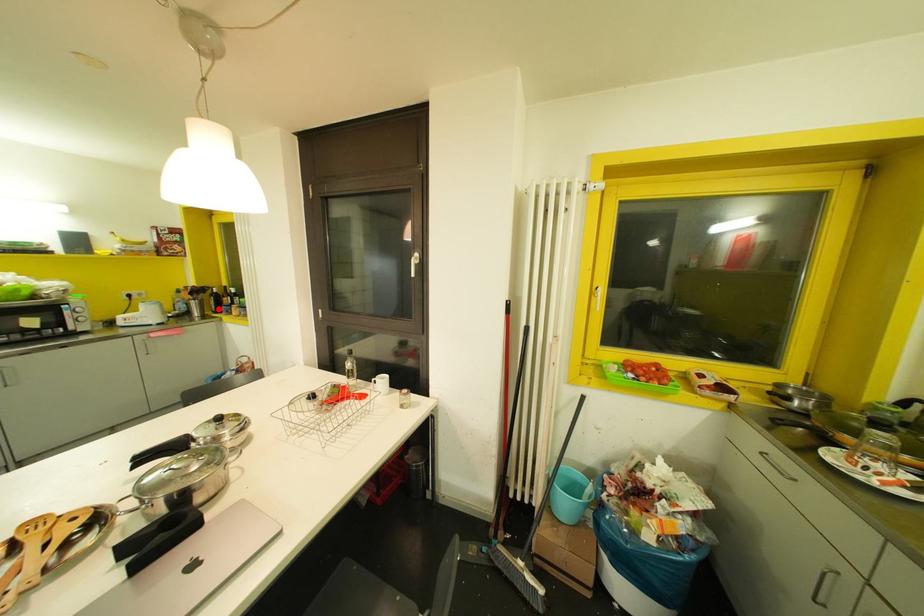
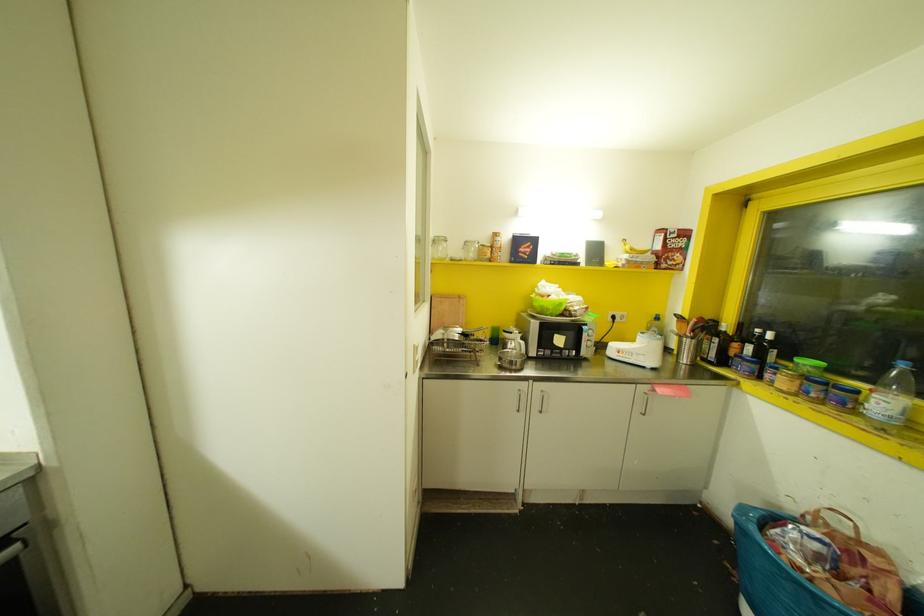
The point at the highlighted location is marked in the first image. Where is the corresponding point in the second image?

(723, 361)